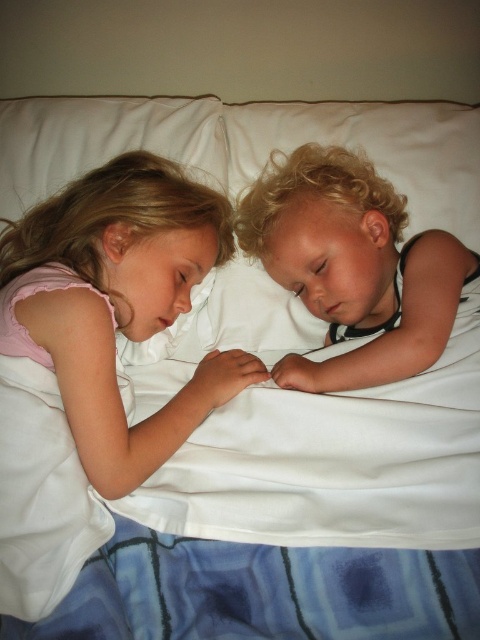
You are a photographer setting up a shoot in this room. You need to place a small lamp between the pink fabric dress at center and the smooth black shirt at right. Based on their positions, will the lamp be closer to the taller object or the shorter one?

The pink fabric dress at center is taller than the smooth black shirt at right, so the lamp placed between them will be closer to the shorter smooth black shirt at right.

You are taking a photo of the two children on the bed. You want to focus on the point closer to the camera. Which point should you choose between point (116, 420) and point (340, 202)?

Point (116, 420) is closer to the camera than point (340, 202), so you should choose point (116, 420) to focus on.